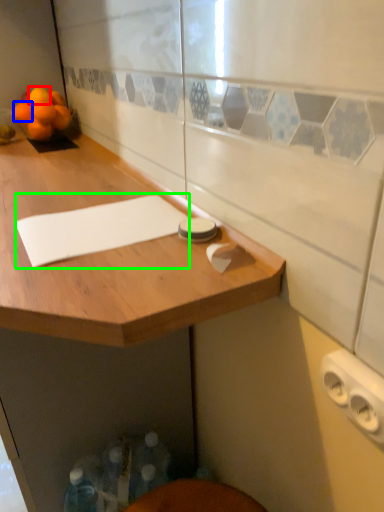
Question: Estimate the real-world distances between objects in this image. Which object is closer to orange (highlighted by a red box), orange (highlighted by a blue box) or notepad (highlighted by a green box)?

Choices:
 (A) orange
 (B) notepad

Answer: (A)